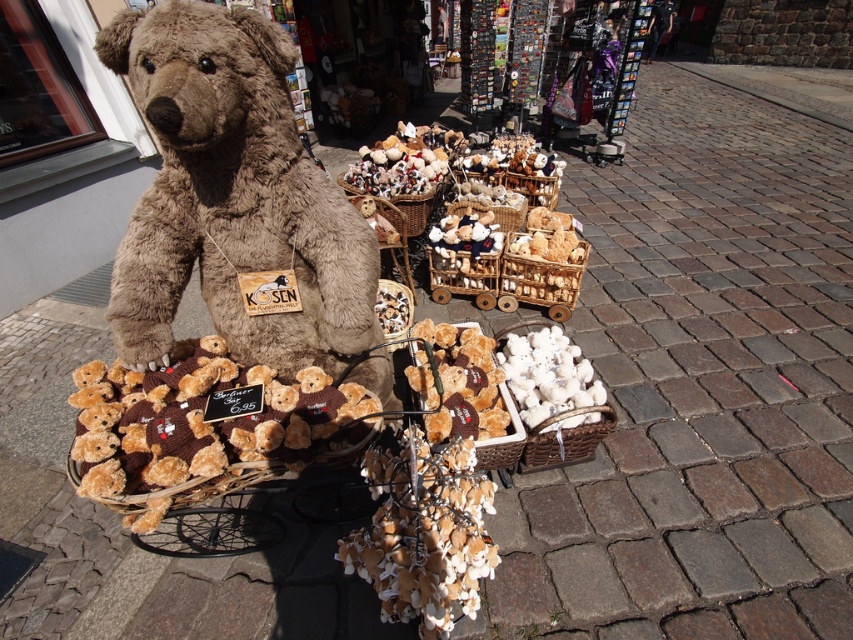
Does soft brown teddy bear at center have a greater height compared to brown wicker basket at center?

Yes, soft brown teddy bear at center is taller than brown wicker basket at center.

The width and height of the screenshot is (853, 640). What do you see at coordinates (231, 198) in the screenshot?
I see `soft brown teddy bear at center` at bounding box center [231, 198].

In order to click on soft brown teddy bear at center in this screenshot , I will do `click(231, 198)`.

Who is more distant from viewer, (497, 220) or (532, 200)?

The point (532, 200) is more distant.

Who is higher up, white wicker basket at center or brown wicker basket at center?

brown wicker basket at center is higher up.

Image resolution: width=853 pixels, height=640 pixels. What are the coordinates of `white wicker basket at center` in the screenshot? It's located at (494, 211).

What are the coordinates of `white wicker basket at center` in the screenshot? It's located at (494, 211).

Does soft brown teddy bear at center appear on the right side of white fabric basket at center?

In fact, soft brown teddy bear at center is to the left of white fabric basket at center.

Does soft brown teddy bear at center come behind white fabric basket at center?

No, soft brown teddy bear at center is closer to the viewer.

Locate an element on the screen. The height and width of the screenshot is (640, 853). soft brown teddy bear at center is located at coordinates (231, 198).

Identify the location of soft brown teddy bear at center. This screenshot has height=640, width=853. (231, 198).